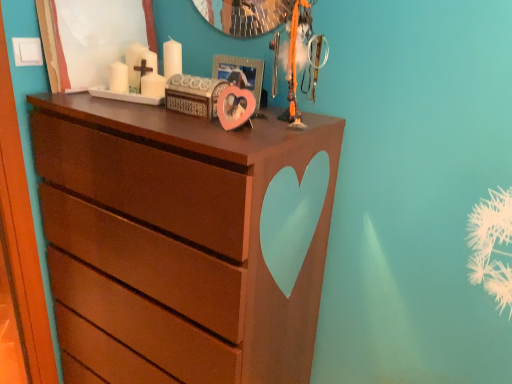
Question: Is brown matte chest of drawers at center in front of or behind pink matte heart at center in the image?

Choices:
 (A) behind
 (B) front

Answer: (B)

Question: Is point (161, 211) positioned closer to the camera than point (247, 79)?

Choices:
 (A) closer
 (B) farther

Answer: (A)

Question: Is brown matte chest of drawers at center to the left or to the right of pink matte heart at center in the image?

Choices:
 (A) left
 (B) right

Answer: (A)

Question: From a real-world perspective, relative to brown matte chest of drawers at center, is pink matte heart at center vertically above or below?

Choices:
 (A) above
 (B) below

Answer: (A)

Question: Relative to brown matte chest of drawers at center, is pink matte heart at center in front or behind?

Choices:
 (A) front
 (B) behind

Answer: (B)

Question: In terms of height, does pink matte heart at center look taller or shorter compared to brown matte chest of drawers at center?

Choices:
 (A) short
 (B) tall

Answer: (A)

Question: Looking at their shapes, would you say pink matte heart at center is wider or thinner than brown matte chest of drawers at center?

Choices:
 (A) thin
 (B) wide

Answer: (A)